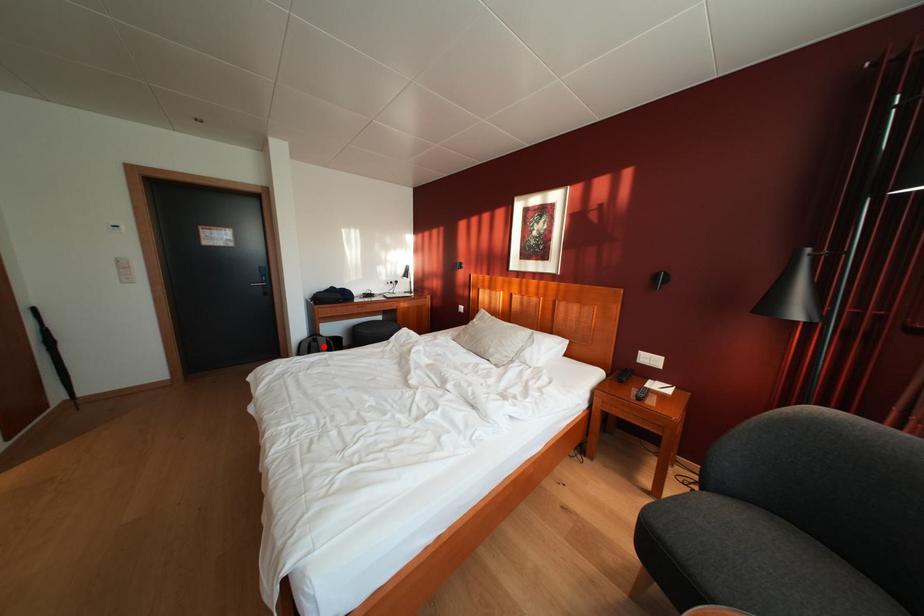
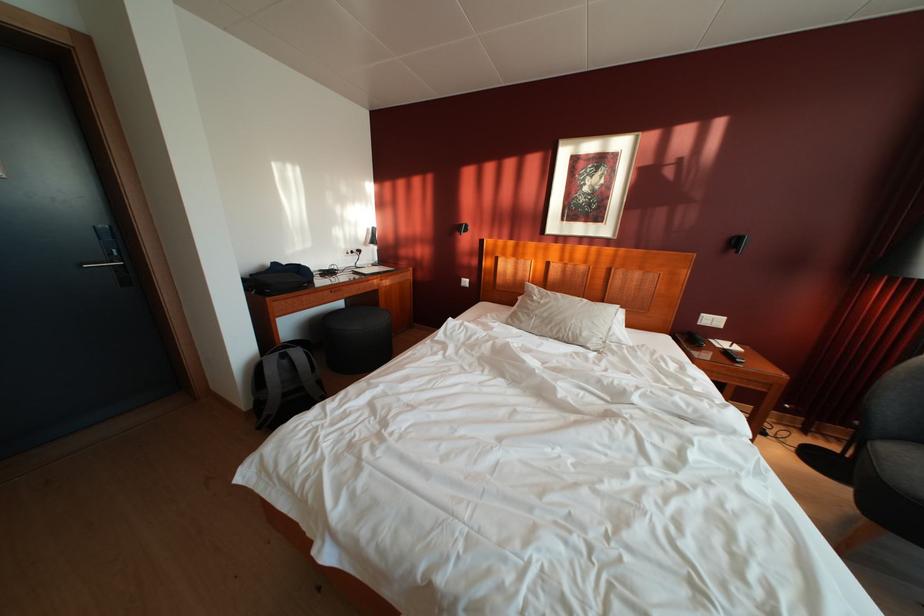
In the second image, find the point that corresponds to the highlighted location in the first image.

(293, 362)